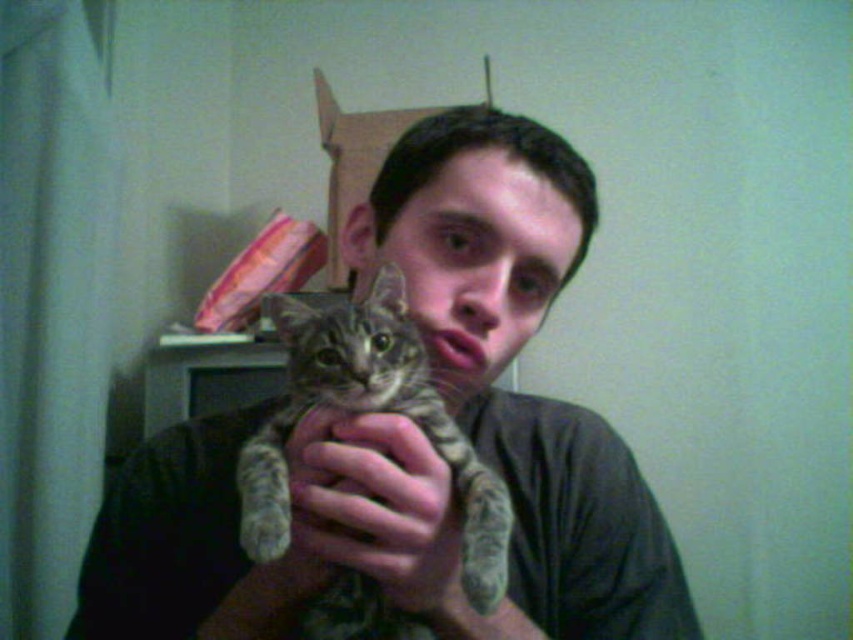
You are a fashion designer observing the image. You need to decide if the smooth gray shirt at center can fully cover the soft fur paw at center. Based on the spatial relationship between them, what is your conclusion?

The smooth gray shirt at center might be wider than soft fur paw at center, so it is possible that the smooth gray shirt at center could cover the soft fur paw at center if positioned correctly.

You are a veterinarian examining a patient. You see the tabby fur cat at center and the soft fur paw at center. Which one is positioned higher in the image?

The tabby fur cat at center is located above the soft fur paw at center, so the tabby fur cat at center is positioned higher in the image.

You are a veterinarian examining a patient. You notice the tabby fur cat at center and the soft fur paw at center. Which part is closer to you?

The tabby fur cat at center is closer to the viewer than the soft fur paw at center.